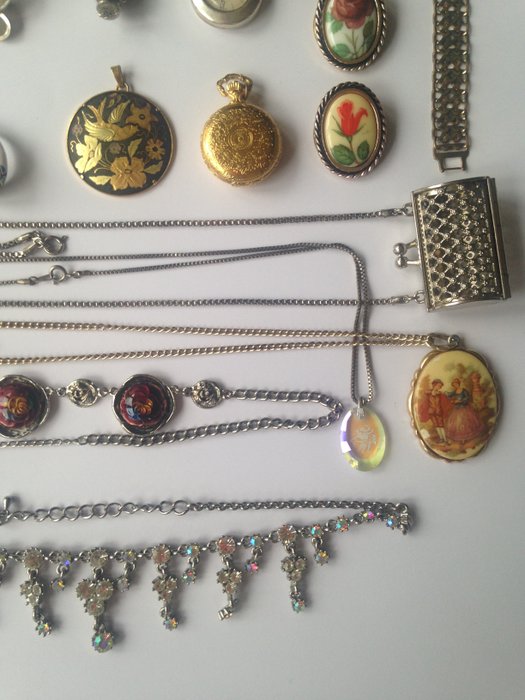
Find the location of a particular element. This screenshot has height=700, width=525. pendants is located at coordinates (364, 440), (457, 414), (247, 144), (134, 152), (465, 252).